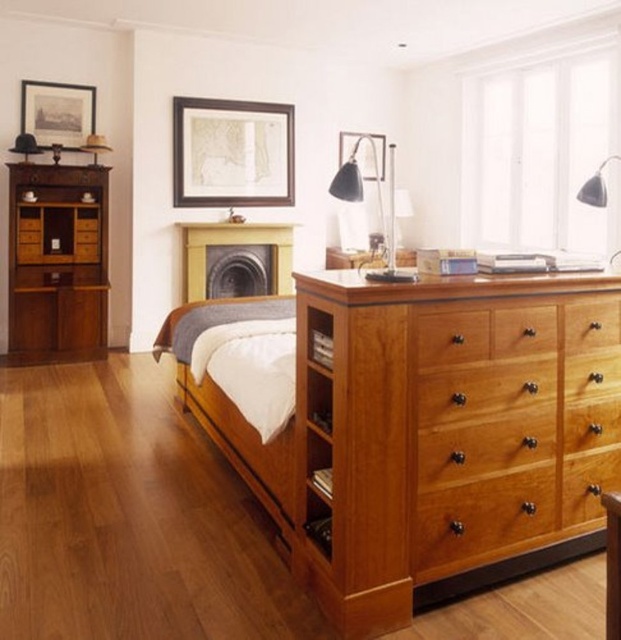
Is cherry wood dresser at lower right thinner than matte wooden picture frame at upper center?

In fact, cherry wood dresser at lower right might be wider than matte wooden picture frame at upper center.

Is cherry wood dresser at lower right positioned at the back of matte wooden picture frame at upper center?

That is False.

Is point (350, 538) less distant than point (233, 188)?

Yes, point (350, 538) is in front of point (233, 188).

This screenshot has height=640, width=621. I want to click on cherry wood dresser at lower right, so click(x=446, y=428).

Locate an element on the screen. black glass lamp at center is located at coordinates (355, 177).

Does light brown wooden bed at center appear over matte black picture frame at upper center?

Incorrect, light brown wooden bed at center is not positioned above matte black picture frame at upper center.

Who is more forward, (x=219, y=387) or (x=369, y=152)?

Point (x=219, y=387) is in front.

Does point (193, 304) lie in front of point (337, 161)?

Yes, it is.

I want to click on light brown wooden bed at center, so click(x=243, y=445).